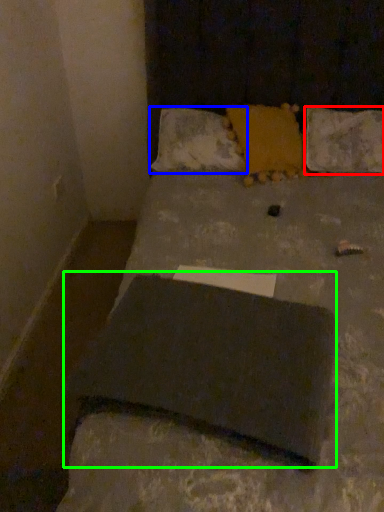
Question: Estimate the real-world distances between objects in this image. Which object is closer to pillow (highlighted by a red box), pillow (highlighted by a blue box) or slate (highlighted by a green box)?

Choices:
 (A) pillow
 (B) slate

Answer: (A)